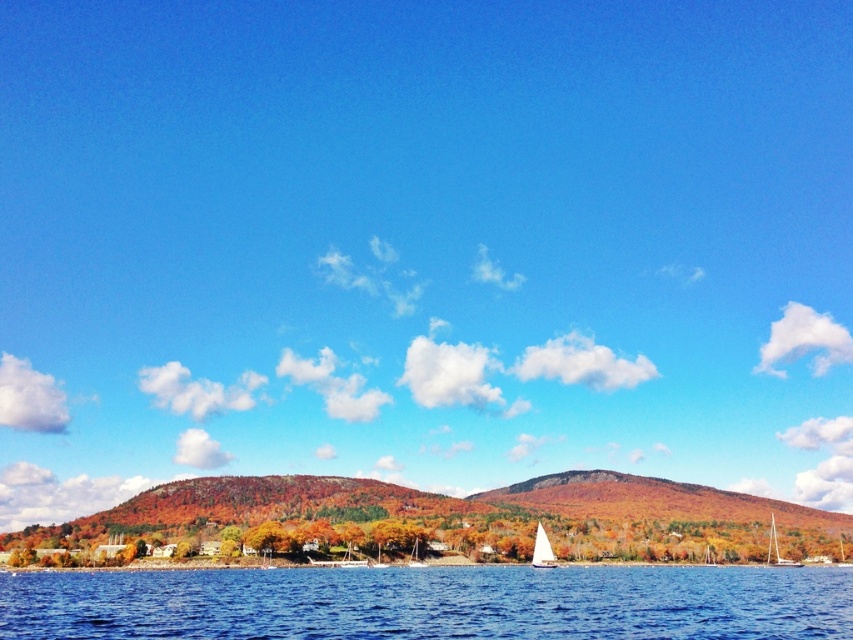
Is blue liquid water at lower center smaller than white glossy sailboat at lower right?

No.

Which of these two, blue liquid water at lower center or white glossy sailboat at lower right, stands taller?

blue liquid water at lower center is taller.

Where is `blue liquid water at lower center`? This screenshot has height=640, width=853. blue liquid water at lower center is located at coordinates (431, 602).

Does blue liquid water at lower center have a larger size compared to white glossy sailboat at center?

Yes.

Is blue liquid water at lower center above white glossy sailboat at center?

Yes, blue liquid water at lower center is above white glossy sailboat at center.

Is point (281, 620) closer to viewer compared to point (415, 544)?

Yes.

Identify the location of blue liquid water at lower center. (431, 602).

Find the location of `white sailboat at lower center`. white sailboat at lower center is located at coordinates (543, 550).

Is point (531, 563) less distant than point (782, 561)?

Yes, point (531, 563) is in front of point (782, 561).

Is point (543, 556) positioned behind point (773, 522)?

No, it is not.

The height and width of the screenshot is (640, 853). What are the coordinates of `white sailboat at lower center` in the screenshot? It's located at (543, 550).